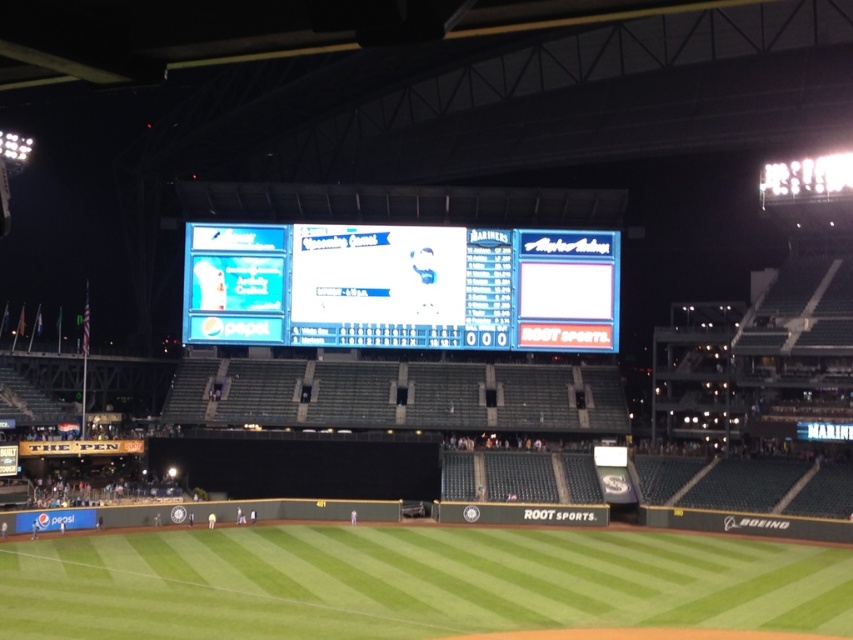
This screenshot has width=853, height=640. What do you see at coordinates (410, 580) in the screenshot?
I see `green grass at center` at bounding box center [410, 580].

Between green grass at center and blue glossy scoreboard at center, which one has more height?

blue glossy scoreboard at center

I want to click on green grass at center, so click(x=410, y=580).